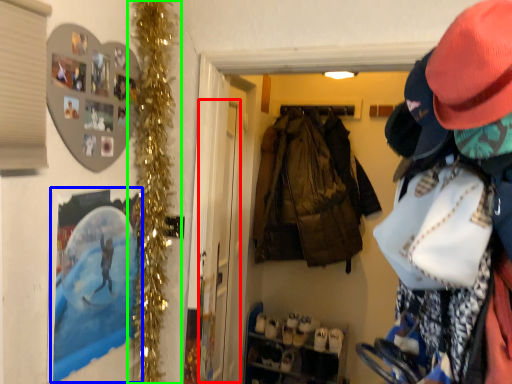
Question: Which object is the closest to the screen door (highlighted by a red box)? Choose among these: picture frame (highlighted by a blue box) or christmas decoration (highlighted by a green box).

Choices:
 (A) picture frame
 (B) christmas decoration

Answer: (B)